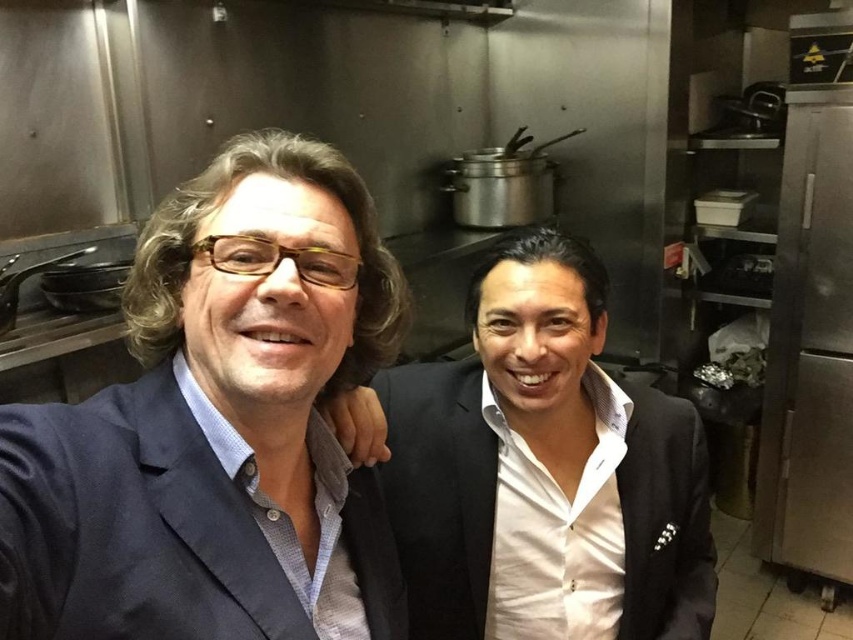
Question: Which point is farther to the camera?

Choices:
 (A) (260, 150)
 (B) (519, 280)

Answer: (B)

Question: Considering the relative positions of matte black suit at left and white glossy shirt at center in the image provided, where is matte black suit at left located with respect to white glossy shirt at center?

Choices:
 (A) right
 (B) left

Answer: (B)

Question: Among these points, which one is nearest to the camera?

Choices:
 (A) (508, 342)
 (B) (51, 461)

Answer: (B)

Question: From the image, what is the correct spatial relationship of matte black suit at left in relation to white glossy shirt at center?

Choices:
 (A) below
 (B) above

Answer: (B)

Question: Is matte black suit at left smaller than white glossy shirt at center?

Choices:
 (A) yes
 (B) no

Answer: (A)